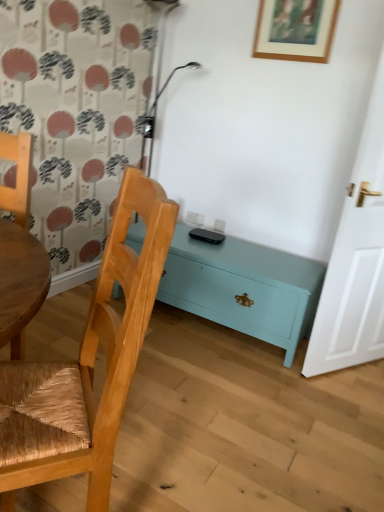
Question: Is white wooden door at right outside of wooden woven chair at left, positioned as the second chair in right-to-left order?

Choices:
 (A) no
 (B) yes

Answer: (B)

Question: Is white wooden door at right facing towards wooden woven chair at left, positioned as the second chair in right-to-left order?

Choices:
 (A) no
 (B) yes

Answer: (A)

Question: Can you confirm if white wooden door at right is smaller than wooden woven chair at left, positioned as the second chair in right-to-left order?

Choices:
 (A) no
 (B) yes

Answer: (A)

Question: Is wooden woven chair at left, positioned as the second chair in right-to-left order, at the back of white wooden door at right?

Choices:
 (A) no
 (B) yes

Answer: (A)

Question: Are white wooden door at right and wooden woven chair at left, which ranks as the first chair in left-to-right order, located far from each other?

Choices:
 (A) yes
 (B) no

Answer: (A)

Question: Does white wooden door at right have a lesser height compared to wooden woven chair at left, which ranks as the first chair in left-to-right order?

Choices:
 (A) no
 (B) yes

Answer: (A)

Question: Is woven wood chair at left, the second chair from the left, to the right of wooden woven chair at left, which ranks as the first chair in left-to-right order, from the viewer's perspective?

Choices:
 (A) no
 (B) yes

Answer: (B)

Question: From a real-world perspective, is woven wood chair at left, which ranks as the first chair in right-to-left order, on top of wooden woven chair at left, positioned as the second chair in right-to-left order?

Choices:
 (A) no
 (B) yes

Answer: (A)

Question: Is woven wood chair at left, which ranks as the first chair in right-to-left order, facing towards wooden woven chair at left, which ranks as the first chair in left-to-right order?

Choices:
 (A) no
 (B) yes

Answer: (A)

Question: From the image's perspective, would you say woven wood chair at left, which ranks as the first chair in right-to-left order, is positioned over wooden woven chair at left, positioned as the second chair in right-to-left order?

Choices:
 (A) yes
 (B) no

Answer: (B)

Question: Does woven wood chair at left, which ranks as the first chair in right-to-left order, have a smaller size compared to wooden woven chair at left, positioned as the second chair in right-to-left order?

Choices:
 (A) yes
 (B) no

Answer: (B)

Question: Considering the relative sizes of woven wood chair at left, which ranks as the first chair in right-to-left order, and wooden woven chair at left, positioned as the second chair in right-to-left order, in the image provided, is woven wood chair at left, which ranks as the first chair in right-to-left order, wider than wooden woven chair at left, positioned as the second chair in right-to-left order,?

Choices:
 (A) no
 (B) yes

Answer: (A)

Question: Is teal painted wood chest at lower center outside wooden picture frame at upper center?

Choices:
 (A) no
 (B) yes

Answer: (B)